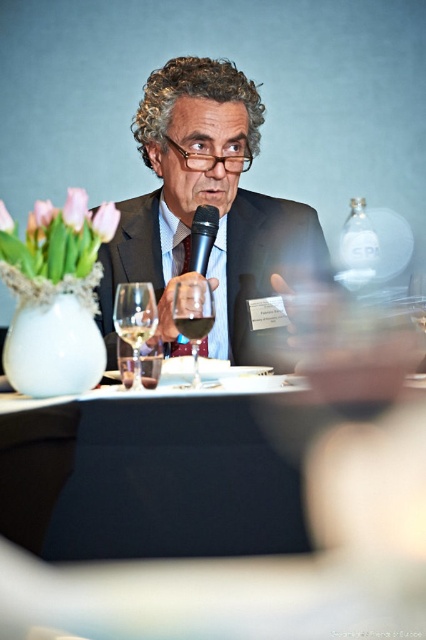
Which is more to the left, black matte microphone at center or translucent glass wine at center?

Positioned to the left is translucent glass wine at center.

Is black matte microphone at center to the right of translucent glass wine at center from the viewer's perspective?

Yes, black matte microphone at center is to the right of translucent glass wine at center.

The image size is (426, 640). What do you see at coordinates (203, 237) in the screenshot? I see `black matte microphone at center` at bounding box center [203, 237].

Image resolution: width=426 pixels, height=640 pixels. I want to click on black matte microphone at center, so click(x=203, y=237).

Does matte black suit at center appear under black matte microphone at center?

No, matte black suit at center is not below black matte microphone at center.

Which is behind, point (264, 225) or point (204, 212)?

The point (264, 225) is more distant.

Does point (180, 237) come closer to viewer compared to point (201, 205)?

No.

You are a GUI agent. You are given a task and a screenshot of the screen. Output one action in this format:
    pyautogui.click(x=<x>, y=<y>)
    Task: Click on the matte black suit at center
    
    Given the screenshot: What is the action you would take?
    pyautogui.click(x=207, y=204)

Can you confirm if clear glass wine glass at center is smaller than clear glass wine at center?

No.

Consider the image. Is clear glass wine glass at center further to the viewer compared to clear glass wine at center?

No, clear glass wine glass at center is in front of clear glass wine at center.

Identify the location of clear glass wine glass at center. This screenshot has width=426, height=640. pyautogui.click(x=135, y=320).

Identify the location of clear glass wine glass at center. Image resolution: width=426 pixels, height=640 pixels. (135, 320).